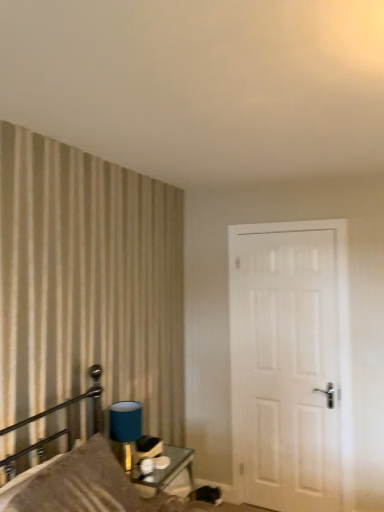
Question: Does white matte door at right have a lesser width compared to textured beige pillow at left?

Choices:
 (A) no
 (B) yes

Answer: (B)

Question: Is white matte door at right facing away from textured beige pillow at left?

Choices:
 (A) no
 (B) yes

Answer: (A)

Question: From a real-world perspective, does white matte door at right stand above textured beige pillow at left?

Choices:
 (A) yes
 (B) no

Answer: (A)

Question: Can you confirm if white matte door at right is taller than textured beige pillow at left?

Choices:
 (A) yes
 (B) no

Answer: (A)

Question: Is white matte door at right at the left side of textured beige pillow at left?

Choices:
 (A) yes
 (B) no

Answer: (B)

Question: Is white matte door at right completely or partially outside of textured beige pillow at left?

Choices:
 (A) no
 (B) yes

Answer: (B)

Question: Is metallic glass table at lower center positioned with its back to satin brown pillow at left?

Choices:
 (A) no
 (B) yes

Answer: (A)

Question: Is metallic glass table at lower center to the left of satin brown pillow at left from the viewer's perspective?

Choices:
 (A) no
 (B) yes

Answer: (A)

Question: From a real-world perspective, is metallic glass table at lower center over satin brown pillow at left?

Choices:
 (A) no
 (B) yes

Answer: (A)

Question: Can we say metallic glass table at lower center lies outside satin brown pillow at left?

Choices:
 (A) yes
 (B) no

Answer: (A)

Question: From the image's perspective, is metallic glass table at lower center located beneath satin brown pillow at left?

Choices:
 (A) yes
 (B) no

Answer: (A)

Question: Is satin brown pillow at left inside metallic glass table at lower center?

Choices:
 (A) yes
 (B) no

Answer: (B)

Question: Is satin brown pillow at left to the left of metallic glass table at lower center from the viewer's perspective?

Choices:
 (A) no
 (B) yes

Answer: (B)